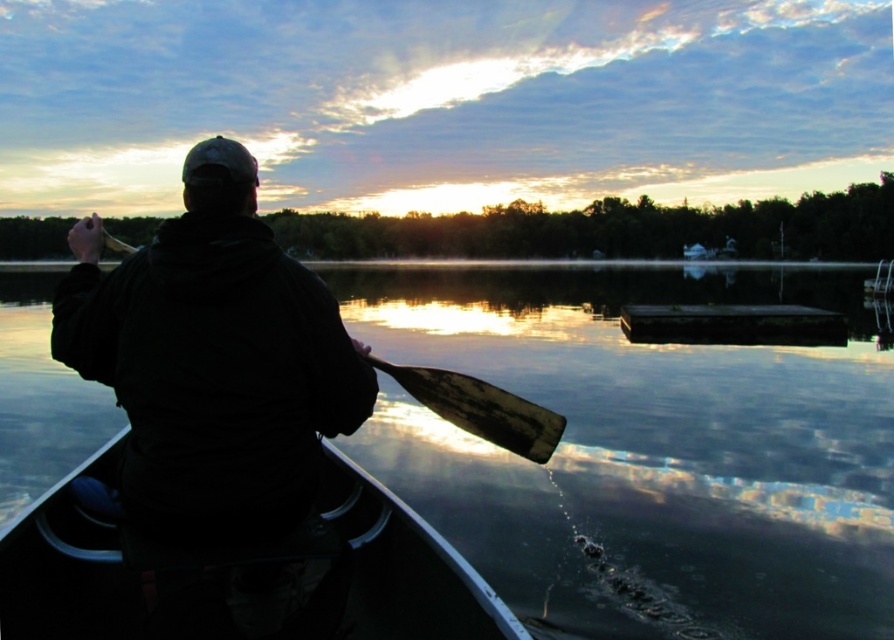
Can you confirm if smooth water at center is smaller than wooden at left?

No, smooth water at center is not smaller than wooden at left.

Identify the location of smooth water at center. pos(646,445).

This screenshot has width=894, height=640. Describe the element at coordinates (646, 445) in the screenshot. I see `smooth water at center` at that location.

Can you confirm if smooth water at center is smaller than black plastic canoe at lower left?

Actually, smooth water at center might be larger than black plastic canoe at lower left.

Between point (534, 376) and point (353, 516), which one is positioned in front?

Point (353, 516) is more forward.

Image resolution: width=894 pixels, height=640 pixels. In order to click on smooth water at center in this screenshot , I will do `click(646, 445)`.

Is wooden at left to the right of wooden paddle at center from the viewer's perspective?

Indeed, wooden at left is positioned on the right side of wooden paddle at center.

Is point (416, 369) positioned in front of point (440, 404)?

Yes, point (416, 369) is in front of point (440, 404).

The image size is (894, 640). I want to click on wooden at left, so click(481, 408).